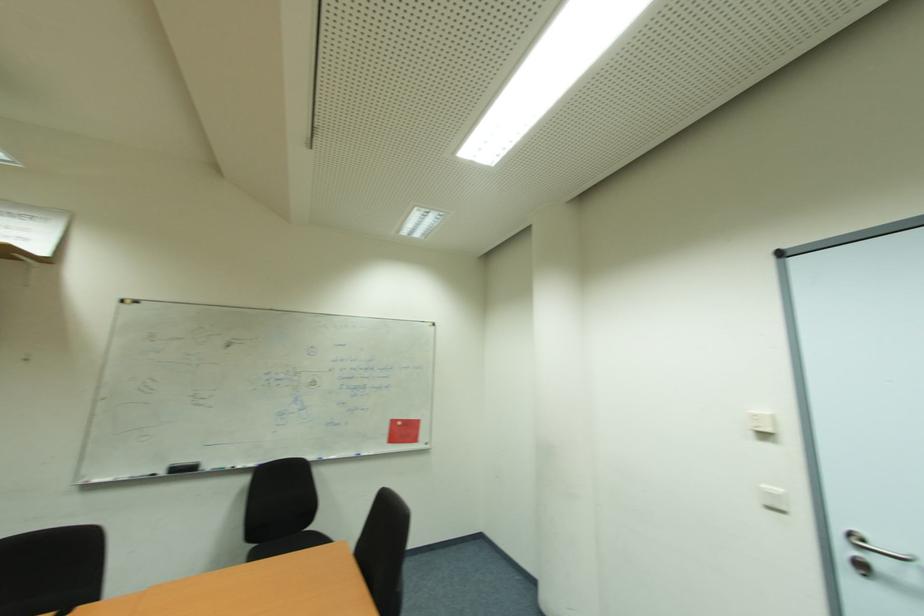
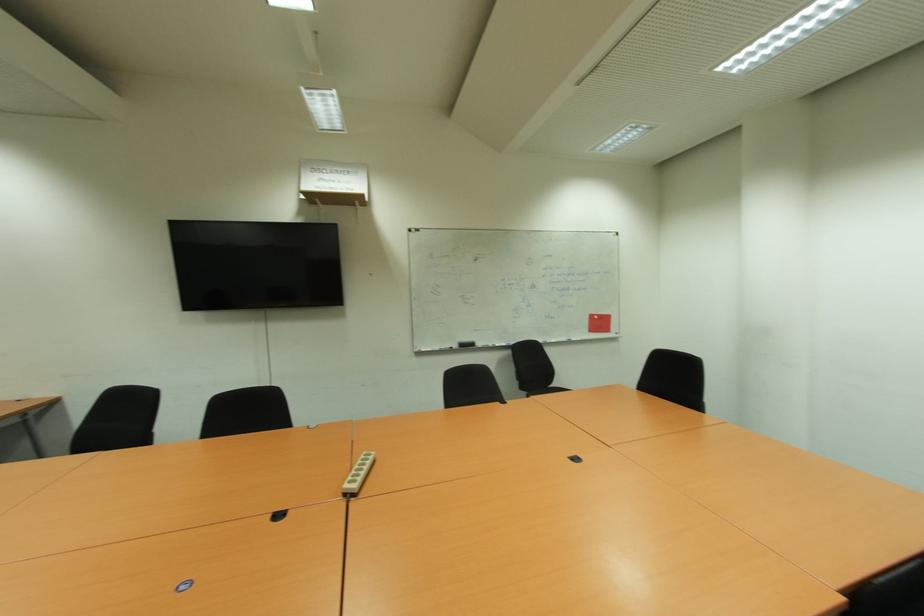
In the second image, find the point that corresponds to (168,471) in the first image.

(457, 347)